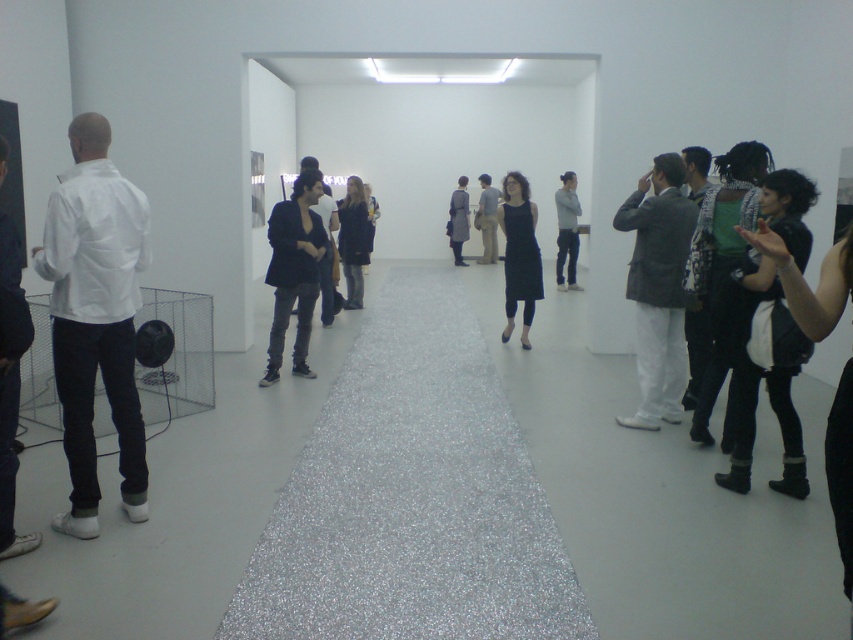
You are a photographer setting up equipment in the art gallery. You need to position a 1.8m tall tripod between the black matte jacket at center and the matte white shirt at left. Can the tripod fit vertically between them without exceeding their heights?

The black matte jacket at center has a lesser height compared to matte white shirt at left. Since the tripod is 1.8m tall, it cannot fit vertically between them because both objects are shorter than the tripod.

You are an event planner arranging a photoshoot in the art gallery. You need to place a model wearing a black matte jacket at center and another wearing a matte white shirt at left. Based on their current positions, which model is standing to the right of the other?

The black matte jacket at center is positioned on the right side of the matte white shirt at left, so the model wearing the black matte jacket at center is standing to the right of the model wearing the matte white shirt at left.